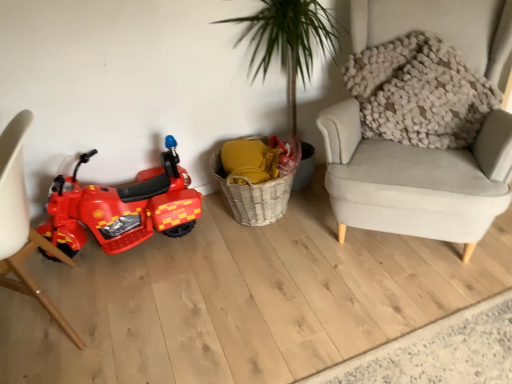
The width and height of the screenshot is (512, 384). What are the coordinates of `free location to the right of matte white chair at left` in the screenshot? It's located at (170, 301).